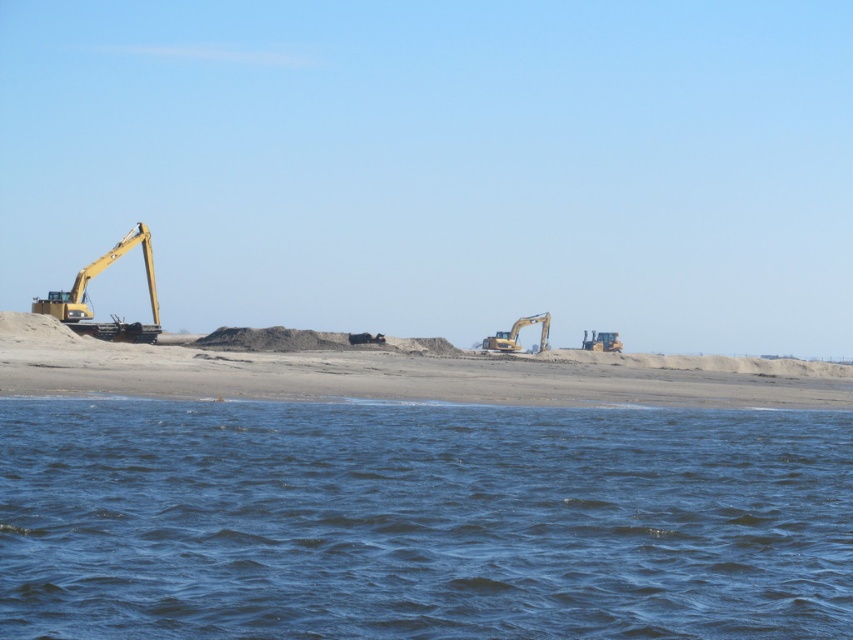
Consider the image. Is smooth sand beach at center to the right of yellow metallic excavator at center from the viewer's perspective?

No, smooth sand beach at center is not to the right of yellow metallic excavator at center.

What do you see at coordinates (387, 374) in the screenshot? I see `smooth sand beach at center` at bounding box center [387, 374].

Find the location of a particular element. smooth sand beach at center is located at coordinates (387, 374).

Looking at this image, between yellow metallic excavator at center and yellow metallic excavator at center-right, which one appears on the right side from the viewer's perspective?

From the viewer's perspective, yellow metallic excavator at center-right appears more on the right side.

Which is behind, point (517, 323) or point (621, 342)?

Point (621, 342)

What do you see at coordinates (517, 333) in the screenshot?
I see `yellow metallic excavator at center` at bounding box center [517, 333].

This screenshot has height=640, width=853. Find the location of `yellow metallic excavator at center`. yellow metallic excavator at center is located at coordinates (517, 333).

Which of these two, smooth sand beach at center or yellow metallic excavator at left, stands shorter?

smooth sand beach at center is shorter.

Between smooth sand beach at center and yellow metallic excavator at left, which one appears on the left side from the viewer's perspective?

From the viewer's perspective, yellow metallic excavator at left appears more on the left side.

Locate an element on the screen. The image size is (853, 640). smooth sand beach at center is located at coordinates (387, 374).

Where is `smooth sand beach at center`? This screenshot has height=640, width=853. smooth sand beach at center is located at coordinates (387, 374).